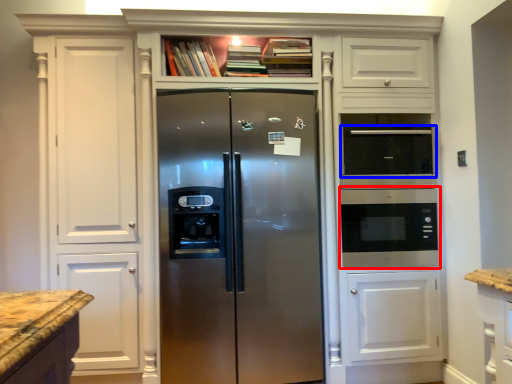
Question: Which of the following is the farthest to the observer, microwave oven (highlighted by a red box) or appliance (highlighted by a blue box)?

Choices:
 (A) microwave oven
 (B) appliance

Answer: (A)